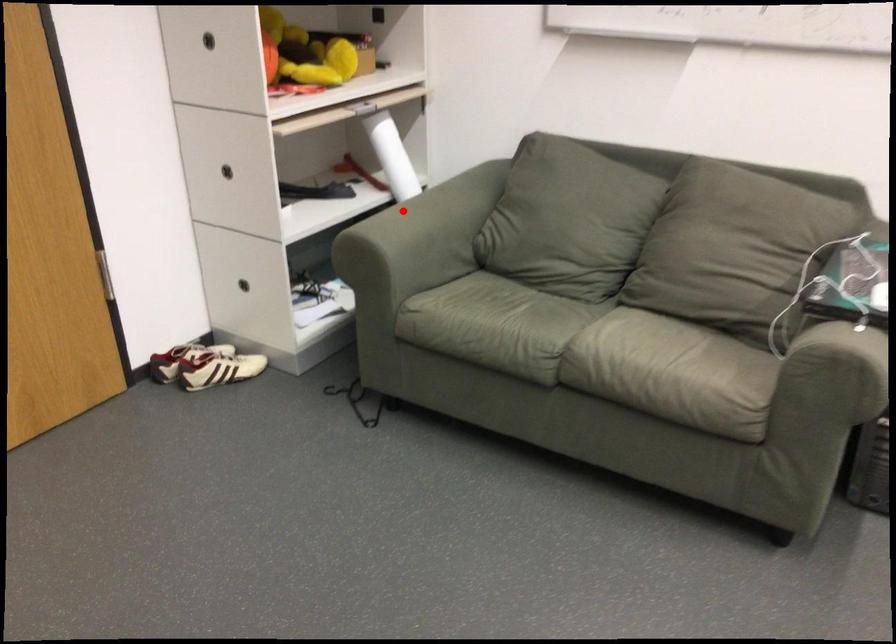
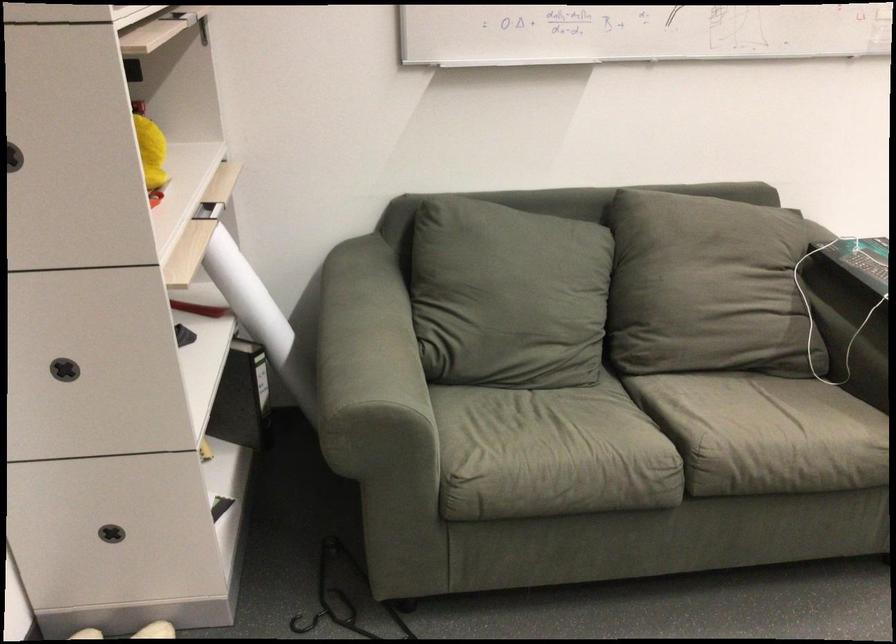
Question: I am providing you with two images of the same scene from different viewpoints. Given a red point in image1, look at the same physical point in image2. Is it:

Choices:
 (A) Closer to the viewpoint
 (B) Farther from the viewpoint

Answer: (A)